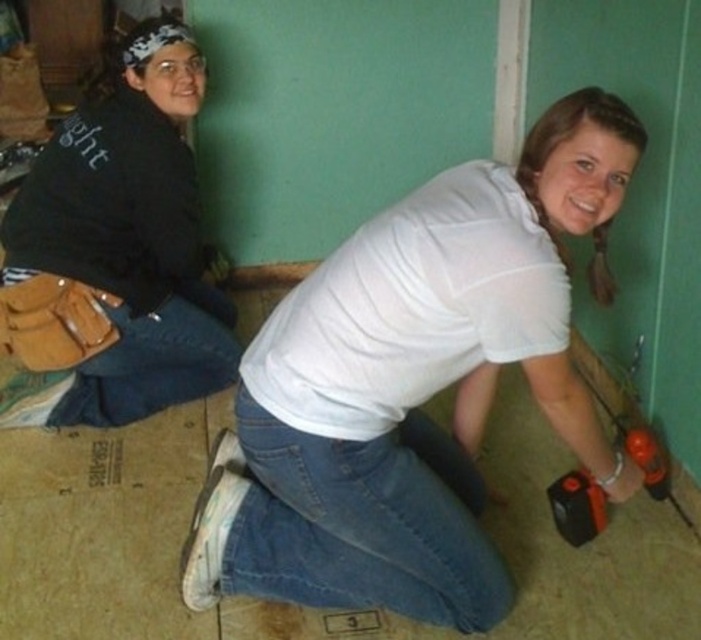
You are an observer standing in the room. You notice the white matte shirt at center and the black matte jacket at upper left. Which one is shorter in height?

The white matte shirt at center has a lesser height compared to the black matte jacket at upper left.

You are a photographer standing 1.5 meters away from the camera. You want to take a photo of the white matte shirt at center. Can you reach the camera to adjust it?

The distance between the white matte shirt at center and the camera is 1.42 meters. Since you are 1.5 meters away from the camera, you are slightly farther than the shirt. You might need to move closer to the camera to adjust it effectively.

You are a delivery person who needs to place a 1 meter long package between the white matte shirt at center and the black matte jacket at upper left. Based on the scene description, will the package fit in the space between them?

The distance between the white matte shirt at center and the black matte jacket at upper left is 84.20 centimeters. Since the package is 1 meter long, which is longer than the available space, the package will not fit between them.